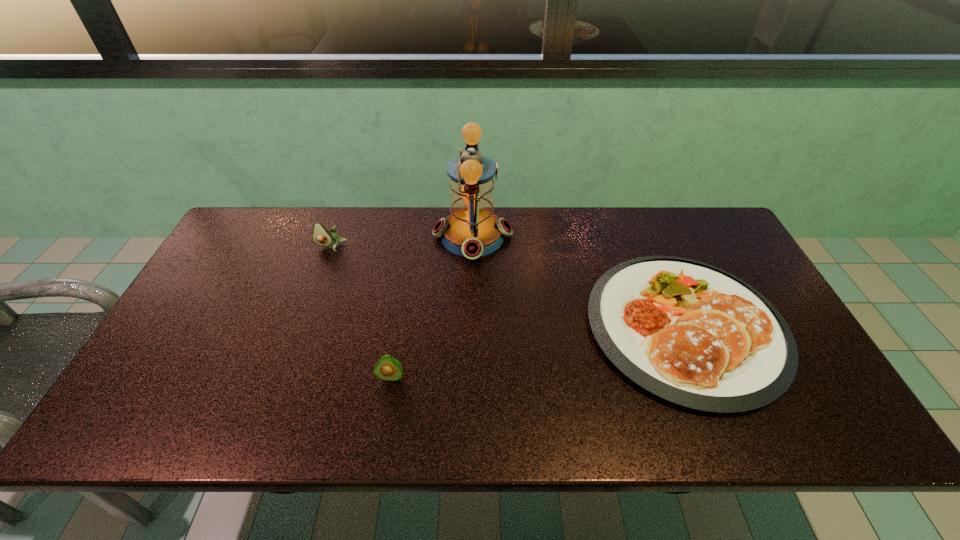
This screenshot has width=960, height=540. I want to click on vacant space that's between the second object from left to right and the third object from left to right, so click(432, 306).

Image resolution: width=960 pixels, height=540 pixels. I want to click on free space between the leftmost object and the lantern, so click(x=402, y=241).

Identify which object is the closest to the second object from left to right. Please provide its 2D coordinates. Your answer should be formatted as a tuple, i.e. [(x, y)], where the tuple contains the x and y coordinates of a point satisfying the conditions above.

[(472, 230)]

Where is `object that is the closest to the farther avocado`? The height and width of the screenshot is (540, 960). object that is the closest to the farther avocado is located at coordinates (472, 230).

I want to click on free space that satisfies the following two spatial constraints: 1. on the front-facing side of the second object from right to left; 2. on the left side of the rightmost object, so click(x=470, y=327).

In order to click on free spot that satisfies the following two spatial constraints: 1. on the back side of the dish; 2. on the front-facing side of the second object from right to left in this screenshot , I will do `click(647, 236)`.

In order to click on vacant space that satisfies the following two spatial constraints: 1. on the front-facing side of the tallest object; 2. on the seed side of the farther avocado in this screenshot , I will do `click(472, 246)`.

At what (x,y) coordinates should I click in order to perform the action: click on vacant area that satisfies the following two spatial constraints: 1. on the front-facing side of the tallest object; 2. on the cut side of the third object from right to left. Please return your answer as a coordinate pair (x, y). The image size is (960, 540). Looking at the image, I should click on (470, 377).

The image size is (960, 540). Identify the location of blank area in the image that satisfies the following two spatial constraints: 1. on the seed side of the leftmost object; 2. on the left side of the shortest object. (301, 327).

At what (x,y) coordinates should I click in order to perform the action: click on free spot that satisfies the following two spatial constraints: 1. on the front-facing side of the dish; 2. on the left side of the tallest object. Please return your answer as a coordinate pair (x, y). Looking at the image, I should click on (470, 327).